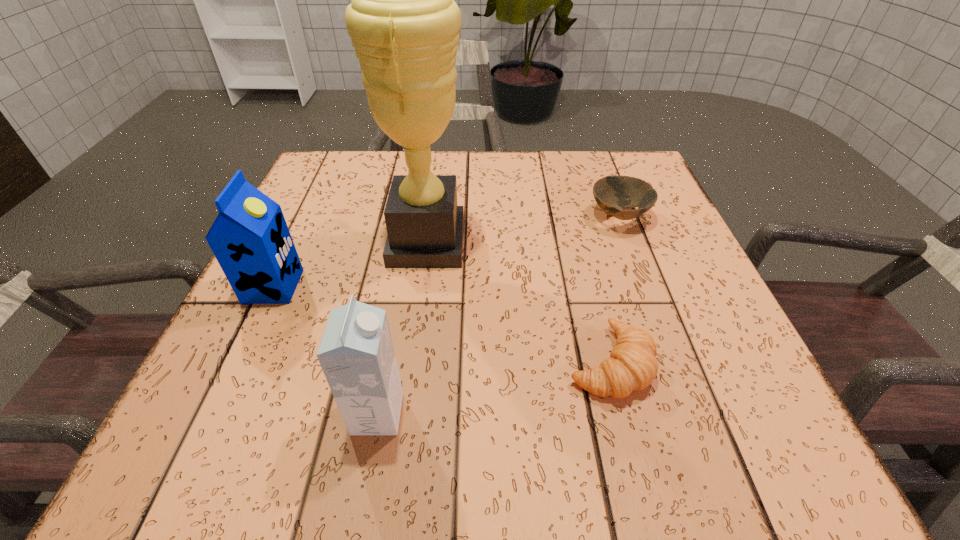
You are a GUI agent. You are given a task and a screenshot of the screen. Output one action in this format:
    pyautogui.click(x=<x>, y=<y>)
    Task: Click on the empty space between the trophy cup and the bowl
    
    Given the screenshot: What is the action you would take?
    pyautogui.click(x=522, y=230)

At what (x,y) coordinates should I click in order to perform the action: click on the closest object to the crescent roll. Please return your answer as a coordinate pair (x, y). Looking at the image, I should click on (x=404, y=24).

Identify which object is the closest to the farther carton. Please provide its 2D coordinates. Your answer should be formatted as a tuple, i.e. [(x, y)], where the tuple contains the x and y coordinates of a point satisfying the conditions above.

[(404, 24)]

The height and width of the screenshot is (540, 960). I want to click on free point that satisfies the following two spatial constraints: 1. at the front of the crescent roll with handles; 2. on the right side of the tallest object, so click(x=411, y=363).

Identify the location of free space in the image that satisfies the following two spatial constraints: 1. on the front side of the bowl; 2. at the front of the trophy cup with handles. This screenshot has width=960, height=540. (628, 242).

Find the location of a particular element. free point that satisfies the following two spatial constraints: 1. on the back side of the crescent roll; 2. at the front of the tallest object with handles is located at coordinates (579, 242).

Identify the location of free space that satisfies the following two spatial constraints: 1. with the cap open on the crescent roll; 2. on the left side of the farther carton. The image size is (960, 540). (237, 363).

Locate an element on the screen. vacant space that satisfies the following two spatial constraints: 1. with the cap open on the crescent roll; 2. on the right side of the farther carton is located at coordinates click(x=237, y=363).

Where is `free location that satisfies the following two spatial constraints: 1. with the cap open on the left carton; 2. on the right side of the crescent roll`? free location that satisfies the following two spatial constraints: 1. with the cap open on the left carton; 2. on the right side of the crescent roll is located at coordinates click(237, 363).

In order to click on vacant region that satisfies the following two spatial constraints: 1. on the back side of the crescent roll; 2. with the cap open on the leftmost object in this screenshot , I will do `click(590, 286)`.